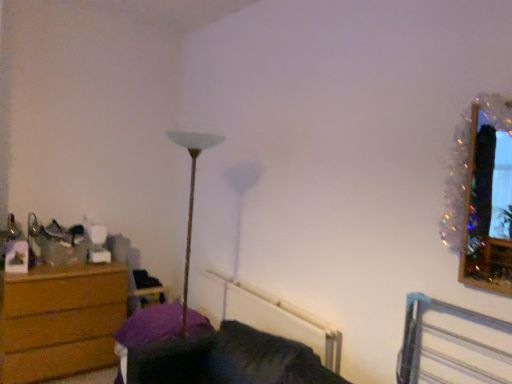
Question: Is the position of white plastic radiator at lower center less distant than that of wooden swivel chair at left?

Choices:
 (A) yes
 (B) no

Answer: (A)

Question: Is white plastic radiator at lower center positioned behind wooden swivel chair at left?

Choices:
 (A) yes
 (B) no

Answer: (B)

Question: Can you confirm if white plastic radiator at lower center is bigger than wooden swivel chair at left?

Choices:
 (A) no
 (B) yes

Answer: (B)

Question: Considering the relative sizes of white plastic radiator at lower center and wooden swivel chair at left in the image provided, is white plastic radiator at lower center shorter than wooden swivel chair at left?

Choices:
 (A) no
 (B) yes

Answer: (B)

Question: Can you confirm if white plastic radiator at lower center is positioned to the left of wooden swivel chair at left?

Choices:
 (A) yes
 (B) no

Answer: (B)

Question: From a real-world perspective, is white plastic radiator at lower center beneath wooden swivel chair at left?

Choices:
 (A) yes
 (B) no

Answer: (A)

Question: From the image's perspective, would you say white plastic radiator at lower center is shown under sparkly tinsel picture frame at upper right?

Choices:
 (A) yes
 (B) no

Answer: (A)

Question: Does white plastic radiator at lower center have a greater width compared to sparkly tinsel picture frame at upper right?

Choices:
 (A) no
 (B) yes

Answer: (B)

Question: Considering the relative positions of white plastic radiator at lower center and sparkly tinsel picture frame at upper right in the image provided, is white plastic radiator at lower center to the right of sparkly tinsel picture frame at upper right from the viewer's perspective?

Choices:
 (A) no
 (B) yes

Answer: (A)

Question: Considering the relative sizes of white plastic radiator at lower center and sparkly tinsel picture frame at upper right in the image provided, is white plastic radiator at lower center smaller than sparkly tinsel picture frame at upper right?

Choices:
 (A) no
 (B) yes

Answer: (A)

Question: Can you see white plastic radiator at lower center touching sparkly tinsel picture frame at upper right?

Choices:
 (A) no
 (B) yes

Answer: (A)

Question: From a real-world perspective, is white plastic radiator at lower center on sparkly tinsel picture frame at upper right?

Choices:
 (A) no
 (B) yes

Answer: (A)

Question: Is wooden swivel chair at left not near metallic silver bed frame at lower right?

Choices:
 (A) no
 (B) yes

Answer: (B)